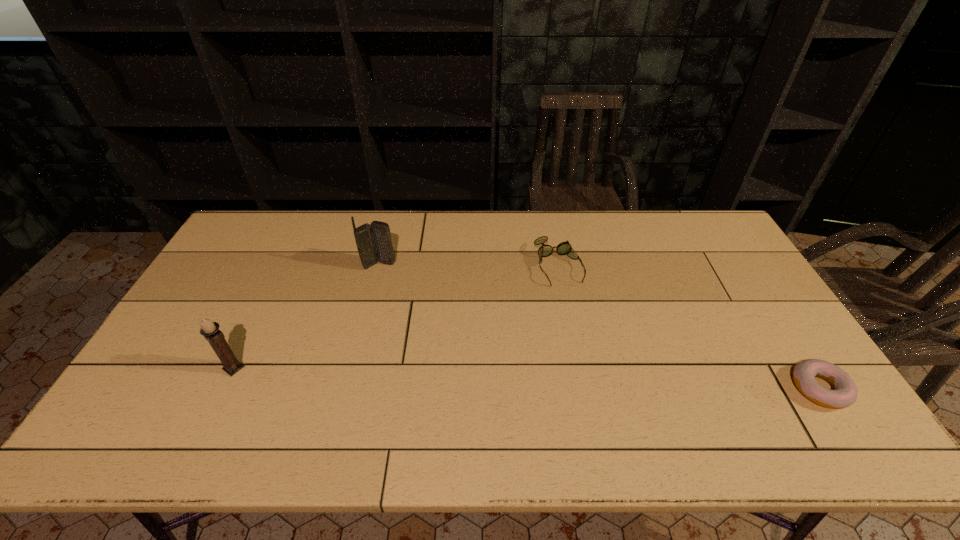
I want to click on vacant region between the second object from right to left and the leftmost object, so click(x=396, y=317).

You are a GUI agent. You are given a task and a screenshot of the screen. Output one action in this format:
    pyautogui.click(x=<x>, y=<y>)
    Task: Click on the vacant area that lies between the shortest object and the spectacles
    This screenshot has width=960, height=540.
    Given the screenshot: What is the action you would take?
    pyautogui.click(x=689, y=327)

I want to click on free spot between the candle holder and the second object from left to right, so click(306, 316).

Locate an element on the screen. The width and height of the screenshot is (960, 540). unoccupied position between the second object from left to right and the doughnut is located at coordinates (599, 327).

I want to click on object that ranks as the closest to the candle holder, so click(x=373, y=241).

Locate which object ranks second in proximity to the candle holder. Please provide its 2D coordinates. Your answer should be formatted as a tuple, i.e. [(x, y)], where the tuple contains the x and y coordinates of a point satisfying the conditions above.

[(564, 248)]

This screenshot has height=540, width=960. Find the location of `free location that satisfies the following two spatial constraints: 1. on the back side of the cellular telephone; 2. on the right side of the candle holder`. free location that satisfies the following two spatial constraints: 1. on the back side of the cellular telephone; 2. on the right side of the candle holder is located at coordinates (284, 265).

Locate an element on the screen. vacant area in the image that satisfies the following two spatial constraints: 1. on the front side of the doughnut; 2. on the right side of the spectacles is located at coordinates (582, 389).

Where is `blank space that satisfies the following two spatial constraints: 1. on the front side of the shortest object; 2. on the left side of the third tallest object`? Image resolution: width=960 pixels, height=540 pixels. blank space that satisfies the following two spatial constraints: 1. on the front side of the shortest object; 2. on the left side of the third tallest object is located at coordinates (582, 389).